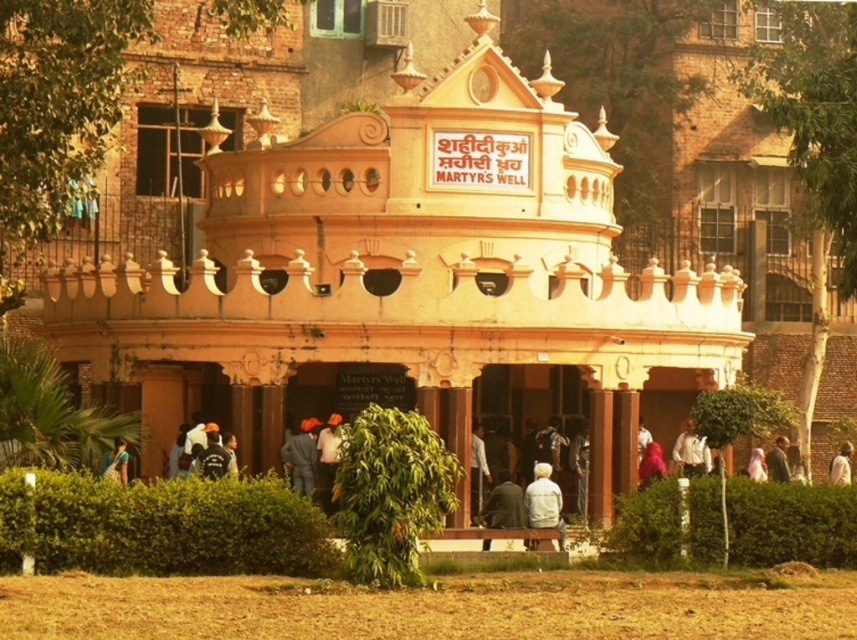
Question: Estimate the real-world distances between objects in this image. Which object is closer to the beige stone building at center?

Choices:
 (A) white shirt at center
 (B) dark gray fabric jacket at center
 (C) blue fabric at center
 (D) pink fabric at center

Answer: (C)

Question: Does white shirt at center appear over light brown fabric person at center?

Choices:
 (A) no
 (B) yes

Answer: (B)

Question: Which of these objects is positioned closest to the white shirt at center?

Choices:
 (A) black fabric at lower center
 (B) blue fabric at center
 (C) white fabric person at center
 (D) light brown fabric person at center

Answer: (C)

Question: Does dark gray fabric jacket at center appear under light brown fabric person at center?

Choices:
 (A) no
 (B) yes

Answer: (B)

Question: Can you confirm if dark gray fabric jacket at center is positioned to the left of light brown fabric person at center?

Choices:
 (A) no
 (B) yes

Answer: (B)

Question: Considering the real-world distances, which object is farthest from the black fabric at lower center?

Choices:
 (A) light gray fabric jacket at center
 (B) blue fabric at center
 (C) white fabric shirt at center

Answer: (C)